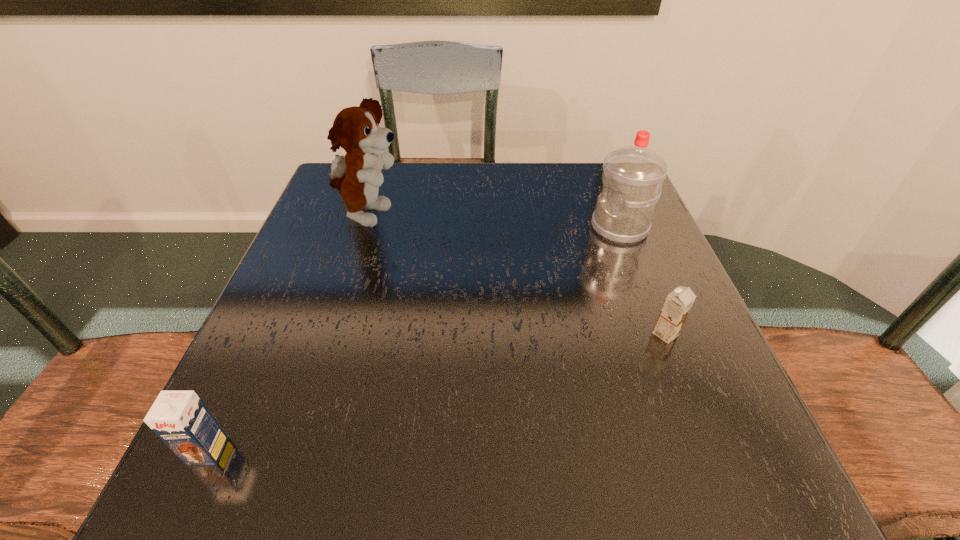
I want to click on free space that satisfies the following two spatial constraints: 1. on the face of the puppy; 2. on the back side of the shortest object, so click(x=332, y=334).

I want to click on vacant space that satisfies the following two spatial constraints: 1. on the handle side of the second tallest object; 2. on the front label of the leftmost object, so click(x=705, y=450).

I want to click on free spot that satisfies the following two spatial constraints: 1. on the handle side of the farther chocolate milk; 2. on the left side of the third shortest object, so click(660, 334).

Identify the location of vacant point that satisfies the following two spatial constraints: 1. on the handle side of the water bottle; 2. on the right side of the third farthest object. (660, 334).

Where is `vacant space that satisfies the following two spatial constraints: 1. on the handle side of the water bottle; 2. on the back side of the shortest object`? This screenshot has width=960, height=540. vacant space that satisfies the following two spatial constraints: 1. on the handle side of the water bottle; 2. on the back side of the shortest object is located at coordinates (x=660, y=334).

The image size is (960, 540). I want to click on vacant space that satisfies the following two spatial constraints: 1. on the face of the right chocolate milk; 2. on the left side of the second object from left to right, so click(x=332, y=334).

Find the location of `blank space that satisfies the following two spatial constraints: 1. on the face of the puppy; 2. on the front label of the leftmost object`. blank space that satisfies the following two spatial constraints: 1. on the face of the puppy; 2. on the front label of the leftmost object is located at coordinates (296, 450).

Locate an element on the screen. free location that satisfies the following two spatial constraints: 1. on the handle side of the water bottle; 2. on the front label of the left chocolate milk is located at coordinates (705, 450).

This screenshot has height=540, width=960. What are the coordinates of `vacant space that satisfies the following two spatial constraints: 1. on the handle side of the second tallest object; 2. on the front label of the left chocolate milk` in the screenshot? It's located at (705, 450).

You are a GUI agent. You are given a task and a screenshot of the screen. Output one action in this format:
    pyautogui.click(x=<x>, y=<y>)
    Task: Click on the blank space that satisfies the following two spatial constraints: 1. on the handle side of the third shortest object; 2. on the back side of the right chocolate milk
    The height and width of the screenshot is (540, 960).
    Given the screenshot: What is the action you would take?
    pyautogui.click(x=660, y=334)